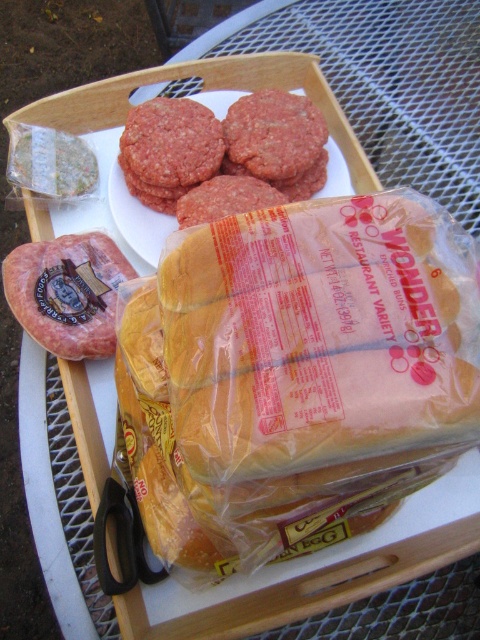
Question: Can you confirm if yellow soft bread at center is smaller than ground beef patty at center?

Choices:
 (A) no
 (B) yes

Answer: (A)

Question: Which point is closer to the camera taking this photo?

Choices:
 (A) (260, 323)
 (B) (144, 124)

Answer: (A)

Question: Among these points, which one is farthest from the camera?

Choices:
 (A) (1, 275)
 (B) (305, 150)

Answer: (B)

Question: Is yellow soft bread at center bigger than smooth pinkish-red meat at center-left?

Choices:
 (A) no
 (B) yes

Answer: (B)

Question: Can you confirm if yellow soft bread at center is wider than ground beef patty at center?

Choices:
 (A) no
 (B) yes

Answer: (B)

Question: Which point is farther to the camera?

Choices:
 (A) (211, 408)
 (B) (68, 284)

Answer: (B)